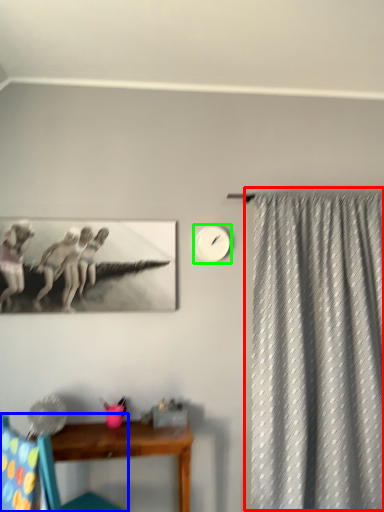
Question: Which object is the closest to the curtain (highlighted by a red box)? Choose among these: chair (highlighted by a blue box) or clock (highlighted by a green box).

Choices:
 (A) chair
 (B) clock

Answer: (B)